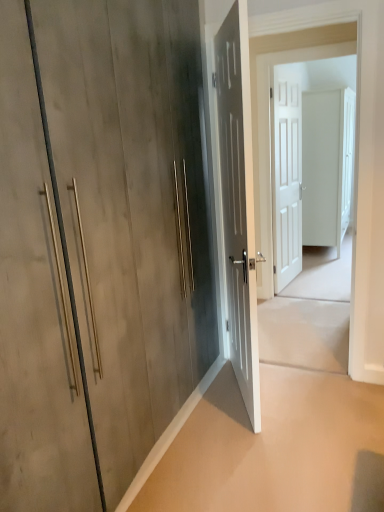
Question: Would you say beige concrete at lower right is to the left or to the right of white matte door at center, the 3th door from the left, in the picture?

Choices:
 (A) right
 (B) left

Answer: (B)

Question: In terms of width, does beige concrete at lower right look wider or thinner when compared to white matte door at center, the 3th door from the left?

Choices:
 (A) wide
 (B) thin

Answer: (A)

Question: Estimate the real-world distances between objects in this image. Which object is closer to the matte gray door at center, positioned as the 3th door in back-to-front order?

Choices:
 (A) white matte door at center, acting as the 4th door starting from the left
 (B) white matte door at center
 (C) white matte door at center, the 3th door when ordered from front to back
 (D) matte wood door at center, the first door positioned from the left
 (E) beige concrete at lower right

Answer: (E)

Question: Based on their relative distances, which object is nearer to the beige concrete at lower right?

Choices:
 (A) matte gray door at center, which appears as the 3th door when viewed from the right
 (B) matte wood door at center, which is counted as the first door, starting from the front
 (C) white matte door at center, which ranks as the 1th door in right-to-left order
 (D) white matte door at center, the 3th door when ordered from front to back
 (E) white matte door at center

Answer: (A)